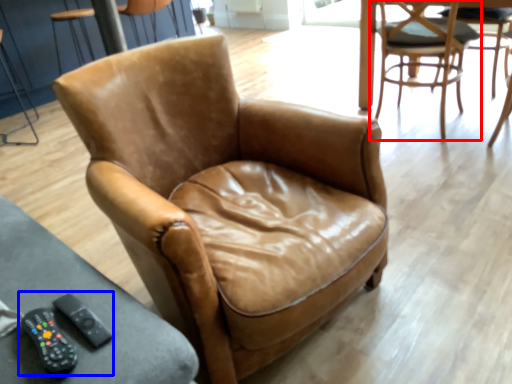
Question: Which object is closer to the camera taking this photo, chair (highlighted by a red box) or game controller (highlighted by a blue box)?

Choices:
 (A) chair
 (B) game controller

Answer: (B)